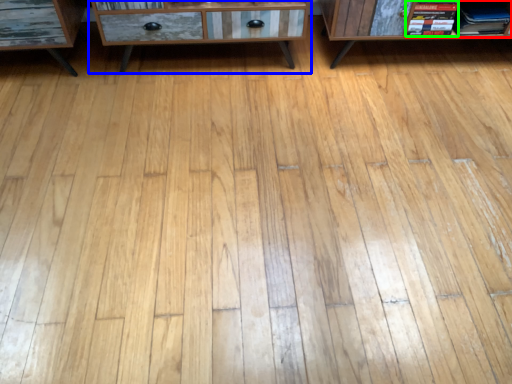
Question: Considering the real-world distances, which object is closest to book (highlighted by a red box)? chest of drawers (highlighted by a blue box) or book (highlighted by a green box).

Choices:
 (A) chest of drawers
 (B) book

Answer: (B)